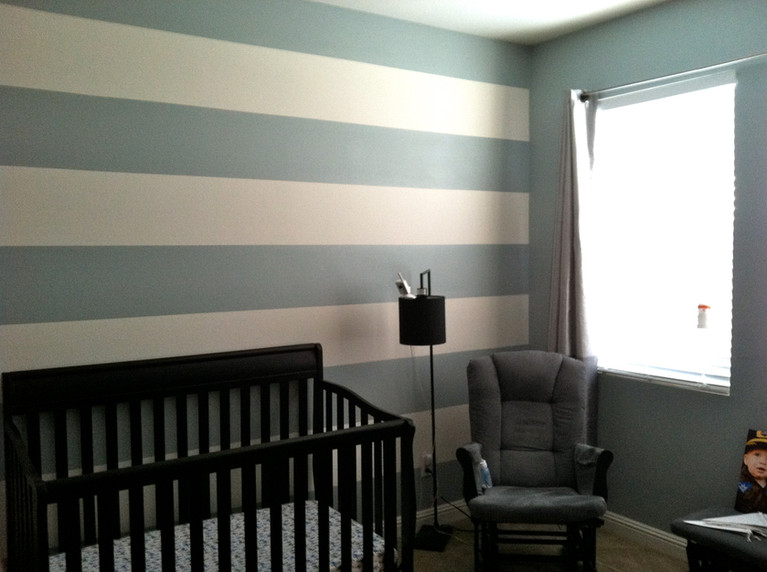
The width and height of the screenshot is (767, 572). Identify the location of lamp cover. (420, 316).